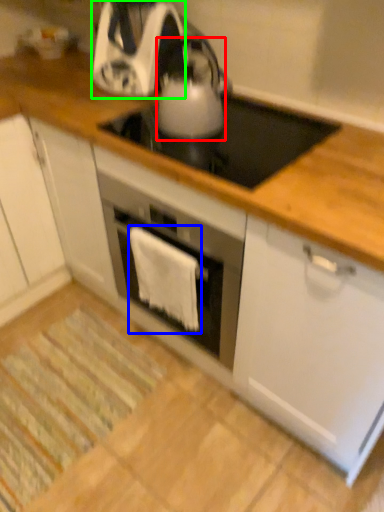
Question: Estimate the real-world distances between objects in this image. Which object is closer to kitchen appliance (highlighted by a red box), cloth (highlighted by a blue box) or kitchen appliance (highlighted by a green box)?

Choices:
 (A) cloth
 (B) kitchen appliance

Answer: (B)